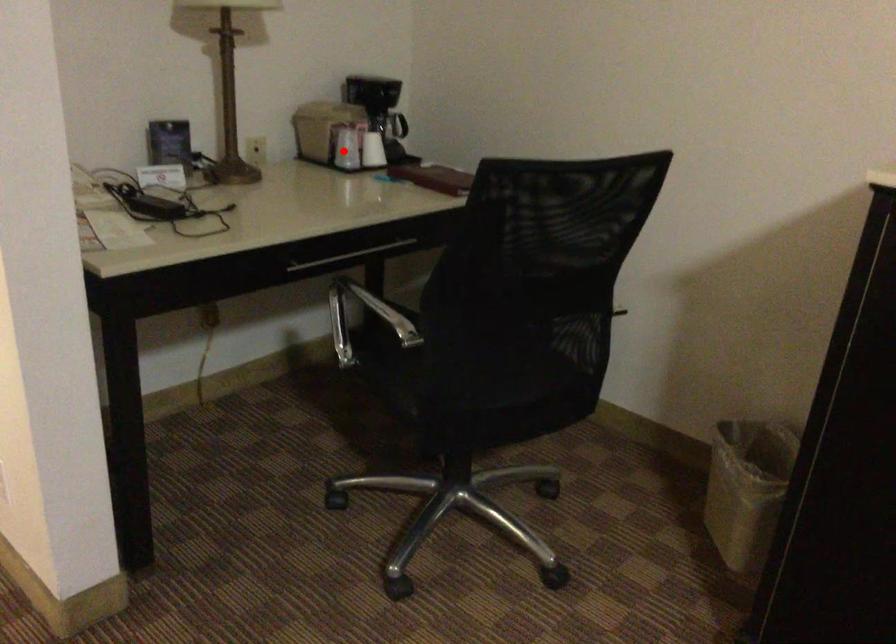
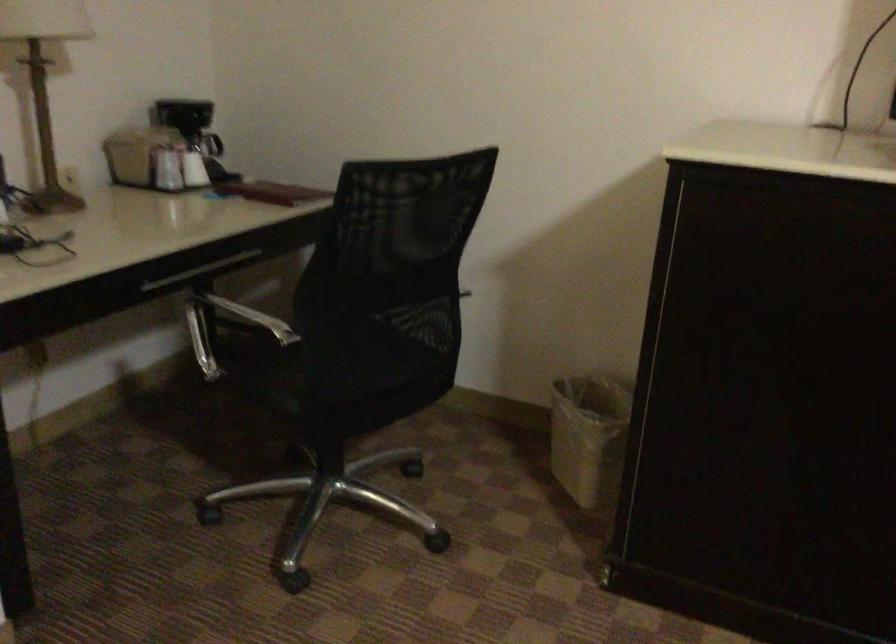
Locate, in the second image, the point that corresponds to the highlighted location in the first image.

(165, 169)